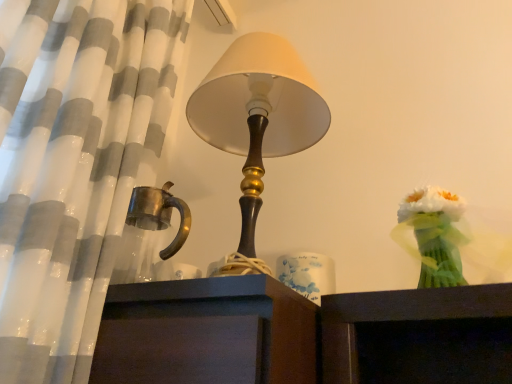
Question: Considering the relative positions of white ceramic candle holder at center and white silk bouquet at right in the image provided, is white ceramic candle holder at center to the left or to the right of white silk bouquet at right?

Choices:
 (A) right
 (B) left

Answer: (B)

Question: Is white ceramic candle holder at center inside the boundaries of white silk bouquet at right, or outside?

Choices:
 (A) outside
 (B) inside

Answer: (A)

Question: From the image's perspective, relative to white silk bouquet at right, is white ceramic candle holder at center above or below?

Choices:
 (A) above
 (B) below

Answer: (B)

Question: Is white silk bouquet at right wider or thinner than white ceramic candle holder at center?

Choices:
 (A) thin
 (B) wide

Answer: (B)

Question: From a real-world perspective, is white silk bouquet at right above or below white ceramic candle holder at center?

Choices:
 (A) below
 (B) above

Answer: (B)

Question: From the image's perspective, is white silk bouquet at right above or below white ceramic candle holder at center?

Choices:
 (A) below
 (B) above

Answer: (B)

Question: Is white silk bouquet at right to the left or to the right of white ceramic candle holder at center in the image?

Choices:
 (A) right
 (B) left

Answer: (A)